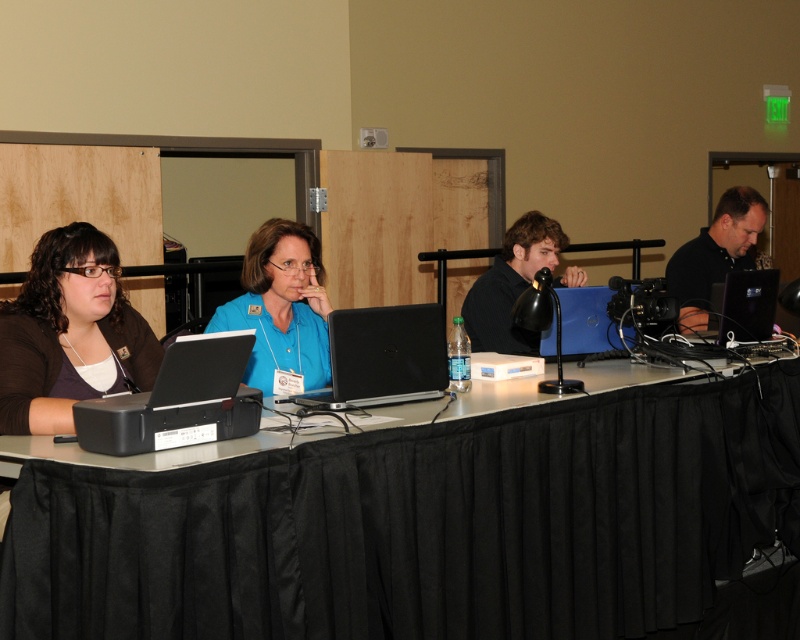
Question: Which object is closer to the camera taking this photo?

Choices:
 (A) dark brown hair at center
 (B) blue matte laptop at center

Answer: (B)

Question: Does matte black laptop at left lie in front of black matte laptop at center?

Choices:
 (A) yes
 (B) no

Answer: (A)

Question: Which point is farther from the camera taking this photo?

Choices:
 (A) (732, 310)
 (B) (720, 202)
 (C) (54, 237)

Answer: (B)

Question: From the image, what is the correct spatial relationship of black matte laptop at center in relation to blue matte laptop at center?

Choices:
 (A) right
 (B) left

Answer: (B)

Question: Among these objects, which one is farthest from the camera?

Choices:
 (A) matte black laptop at left
 (B) black matte laptop at center
 (C) blue matte laptop at center

Answer: (C)

Question: Does black fabric table at center appear on the right side of black glossy laptop at right?

Choices:
 (A) no
 (B) yes

Answer: (A)